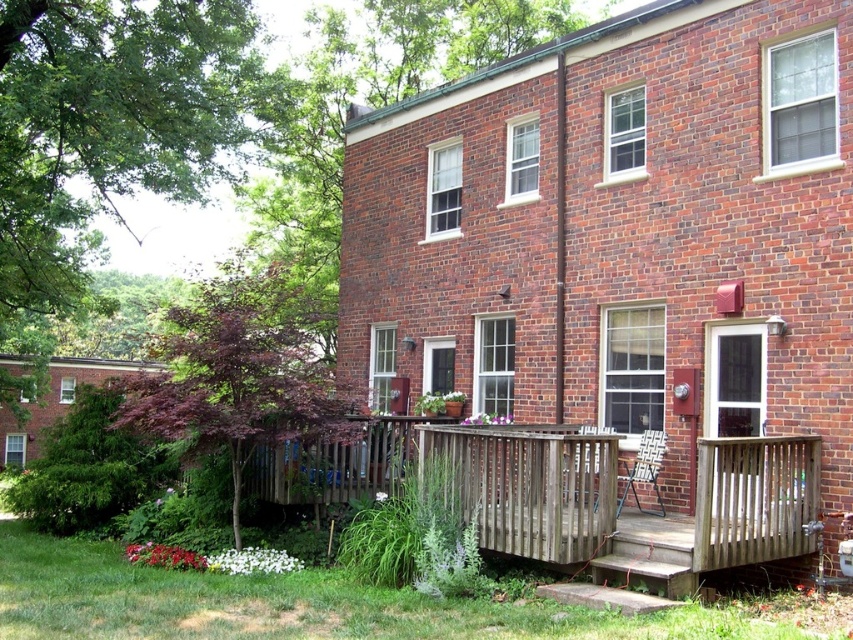
You are standing on the deck and want to move from the weathered wood railing at lower center to the weathered wood porch at center. Which direction should you move to reach the porch?

You should move to the right to reach the weathered wood porch at center since it is located to the right of the weathered wood railing at lower center.

Based on the photo, you are planning to place a large potted plant on the weathered wood porch at center and the weathered wood railing at lower center. Based on their sizes, which location would be more suitable for the plant?

The weathered wood railing at lower center is more suitable because it occupies more space than the weathered wood porch at center, providing enough room for the large potted plant.

You are planning to place a large potted plant on the weathered wood porch at center and the weathered wood railing at lower center. Based on their widths, which location would be more stable for the plant?

The weathered wood railing at lower center is wider than the weathered wood porch at center, so placing the large potted plant on the weathered wood railing at lower center would be more stable.